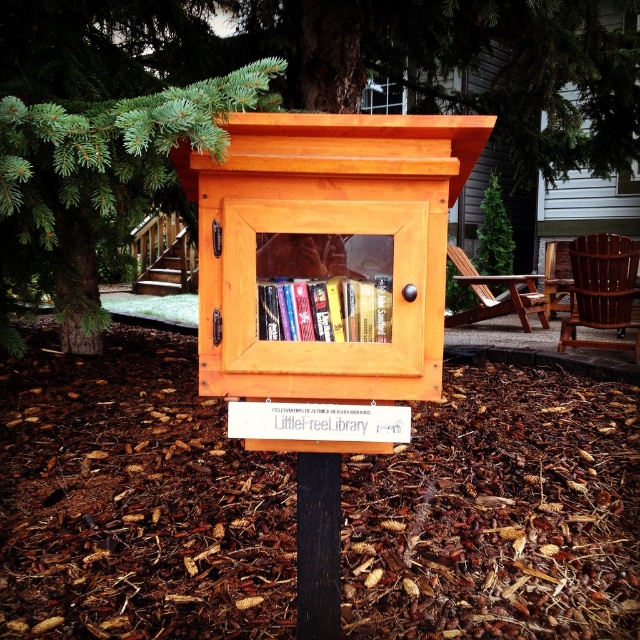
You are standing in front of the library and notice two points marked on the structure. Which point, point (x=324, y=280) or point (x=307, y=547), is closer to you?

Point (x=324, y=280) is closer to the viewer than point (x=307, y=547).

You are a delivery person who needs to place a package between the green pine tree at upper center and the hardcover books at center. Is there enough space to place the package there?

The distance between the green pine tree at upper center and the hardcover books at center is 4.32 meters, so yes, there is enough space to place the package between them.

You are a bird flying towards the green pine tree at upper center and the black wood post at center. Which one will you reach first if you fly straight from your current position?

The green pine tree at upper center is closer to your current position than the black wood post at center, so you will reach the green pine tree at upper center first.